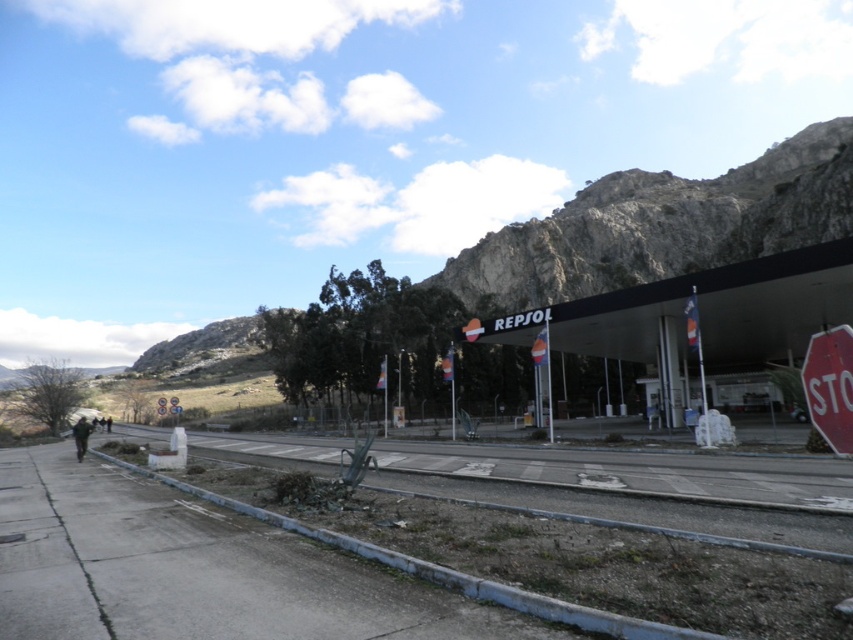
Question: Is red matte stop sign at lower right thinner than dark gray jacket at lower left?

Choices:
 (A) no
 (B) yes

Answer: (B)

Question: Estimate the real-world distances between objects in this image. Which object is closer to the gray concrete train track at lower center?

Choices:
 (A) dark gray jacket at lower left
 (B) red matte stop sign at lower right

Answer: (A)

Question: Which of the following is the farthest from the observer?

Choices:
 (A) dark gray jacket at lower left
 (B) gray concrete train track at lower center
 (C) red matte stop sign at lower right
 (D) gray concrete pavement at lower left

Answer: (A)

Question: Can you confirm if gray concrete train track at lower center is bigger than dark gray jacket at lower left?

Choices:
 (A) no
 (B) yes

Answer: (A)

Question: Which of the following is the closest to the observer?

Choices:
 (A) red matte stop sign at lower right
 (B) dark gray jacket at lower left
 (C) gray concrete pavement at lower left
 (D) gray concrete train track at lower center

Answer: (C)

Question: Is gray concrete pavement at lower left further to the viewer compared to gray concrete train track at lower center?

Choices:
 (A) no
 (B) yes

Answer: (A)